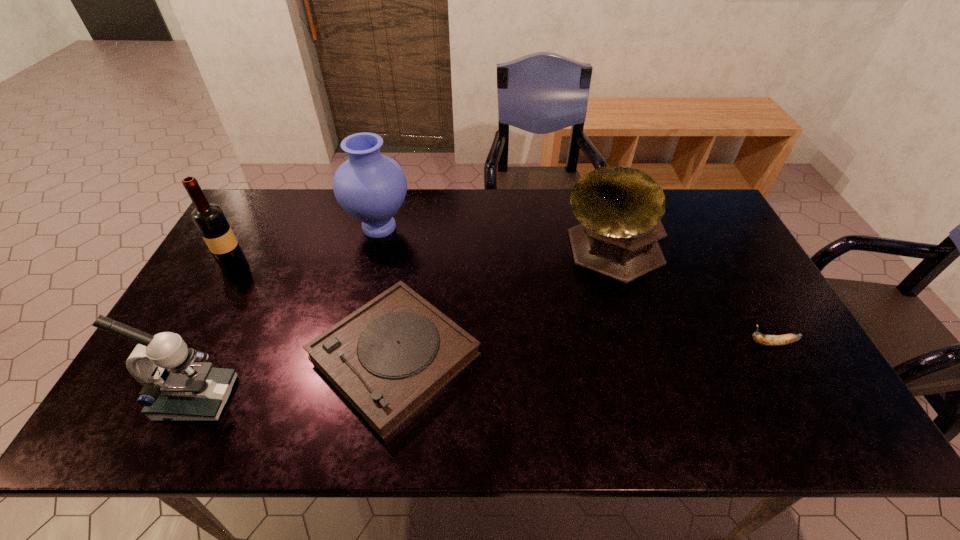
In order to click on free space between the vase and the microscope in this screenshot , I will do `click(288, 313)`.

Identify the location of vacant area between the wine bottle and the rightmost object. (503, 305).

Image resolution: width=960 pixels, height=540 pixels. What are the coordinates of `free space between the taller phonograph record and the banana` in the screenshot? It's located at (690, 298).

This screenshot has width=960, height=540. In order to click on empty location between the microscope and the vase in this screenshot , I will do `click(288, 313)`.

The width and height of the screenshot is (960, 540). Identify the location of empty space that is in between the wine bottle and the shorter phonograph record. (315, 311).

Identify the location of empty space that is in between the vase and the taller phonograph record. The height and width of the screenshot is (540, 960). point(494,239).

Find the location of a particular element. The image size is (960, 540). blank region between the vase and the right phonograph record is located at coordinates (494, 239).

This screenshot has width=960, height=540. What are the coordinates of `free space between the wine bottle and the microscope` in the screenshot? It's located at (215, 332).

Identify which object is the nearest to the shorter phonograph record. Please provide its 2D coordinates. Your answer should be formatted as a tuple, i.e. [(x, y)], where the tuple contains the x and y coordinates of a point satisfying the conditions above.

[(175, 388)]

Locate which object ranks in proximity to the wine bottle. Please provide its 2D coordinates. Your answer should be formatted as a tuple, i.e. [(x, y)], where the tuple contains the x and y coordinates of a point satisfying the conditions above.

[(371, 187)]